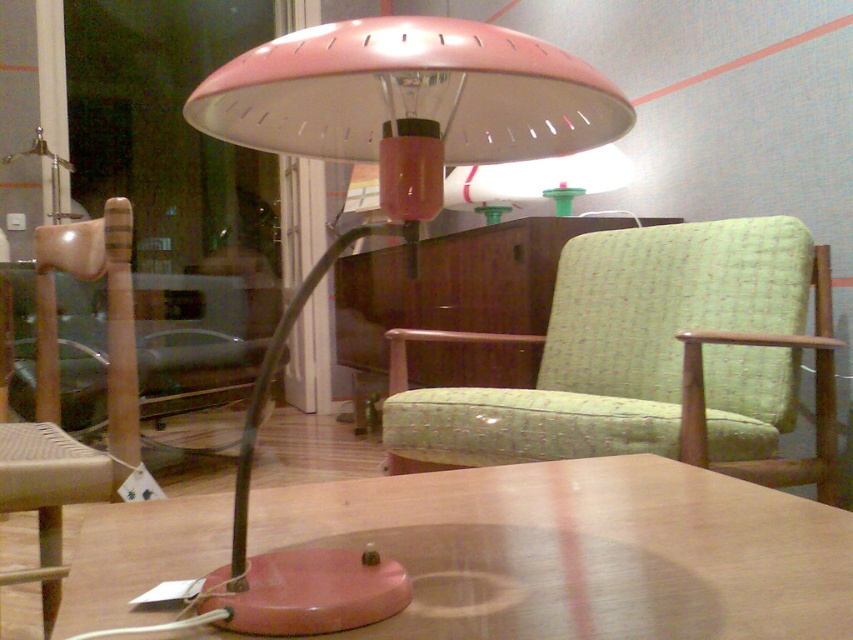
Question: Which point is closer to the camera?

Choices:
 (A) (448, 445)
 (B) (461, 20)
 (C) (752, 579)

Answer: (B)

Question: Which of the following is the farthest from the observer?

Choices:
 (A) (613, 122)
 (B) (573, 572)

Answer: (A)

Question: Can you confirm if matte pink table at center is bigger than pink matte table lamp at center?

Choices:
 (A) no
 (B) yes

Answer: (A)

Question: Is green fabric swivel chair at center thinner than pink matte table lamp at center?

Choices:
 (A) no
 (B) yes

Answer: (A)

Question: Which object appears farthest from the camera in this image?

Choices:
 (A) matte pink table at center
 (B) green fabric swivel chair at center

Answer: (B)

Question: Is matte pink table at center positioned in front of green fabric swivel chair at center?

Choices:
 (A) no
 (B) yes

Answer: (B)